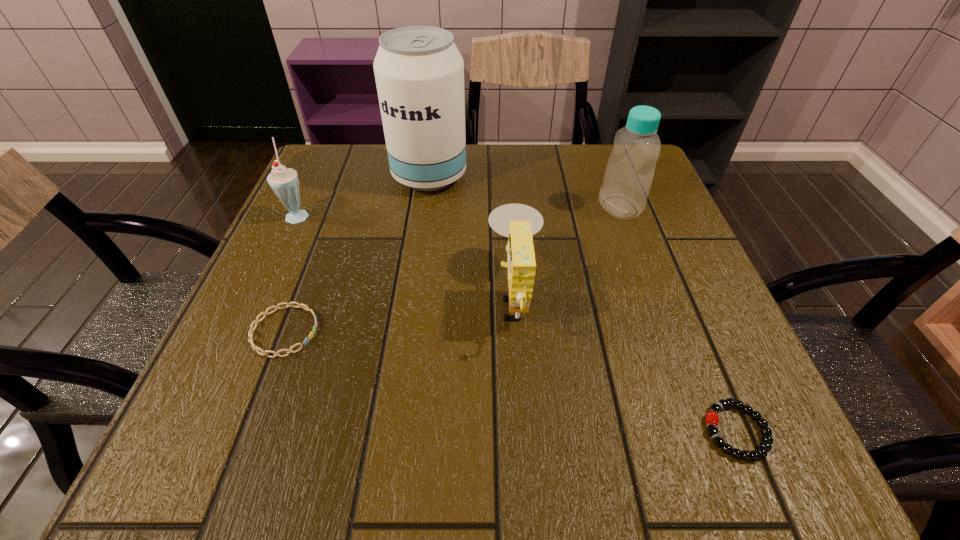
Find the location of `vacant region at the near right corner of the desktop`. vacant region at the near right corner of the desktop is located at coordinates (753, 463).

Where is `vacant area that lies between the third object from right to left and the nearest object`? This screenshot has width=960, height=540. vacant area that lies between the third object from right to left and the nearest object is located at coordinates (625, 363).

Find the location of a particular element. free area in between the milkshake and the nearest object is located at coordinates (517, 322).

Locate an element on the screen. This screenshot has height=540, width=960. vacant area that lies between the fifth shortest object and the right bracelet is located at coordinates (678, 319).

Where is `vacant point located between the fourth object from left to right and the alcohol`? Image resolution: width=960 pixels, height=540 pixels. vacant point located between the fourth object from left to right and the alcohol is located at coordinates (472, 235).

Where is `vacant region between the third object from right to left and the nearer bracelet`? vacant region between the third object from right to left and the nearer bracelet is located at coordinates (625, 363).

Where is `free spot between the second tallest object and the fourth object from right to left`? This screenshot has height=540, width=960. free spot between the second tallest object and the fourth object from right to left is located at coordinates (524, 192).

The width and height of the screenshot is (960, 540). I want to click on unoccupied area between the left bracelet and the bottle, so click(452, 269).

You are a GUI agent. You are given a task and a screenshot of the screen. Output one action in this format:
    pyautogui.click(x=<x>, y=<y>)
    Task: Click on the free area in between the nearer bracelet and the milkshake
    
    Given the screenshot: What is the action you would take?
    pyautogui.click(x=517, y=322)

You are a GUI agent. You are given a task and a screenshot of the screen. Output one action in this format:
    pyautogui.click(x=<x>, y=<y>)
    Task: Click on the vacant space in between the farther bracelet and the milkshake
    This screenshot has width=960, height=540.
    Given the screenshot: What is the action you would take?
    pyautogui.click(x=292, y=273)